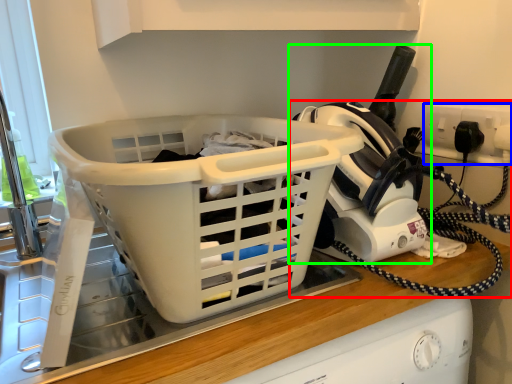
Question: Which is farther away from home appliance (highlighted by a red box)? electric outlet (highlighted by a blue box) or appliance (highlighted by a green box)?

Choices:
 (A) electric outlet
 (B) appliance

Answer: (A)